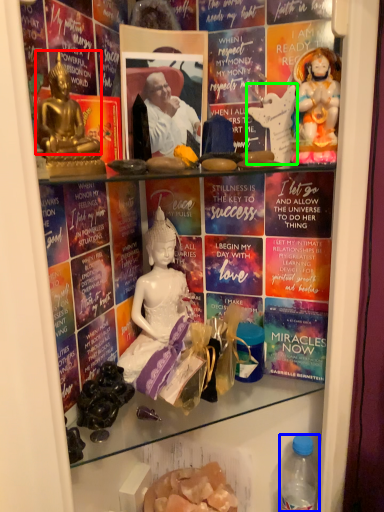
Question: Which is nearer to the person (highlighted by a red box)? bottle (highlighted by a blue box) or sculpture (highlighted by a green box).

Choices:
 (A) bottle
 (B) sculpture

Answer: (B)